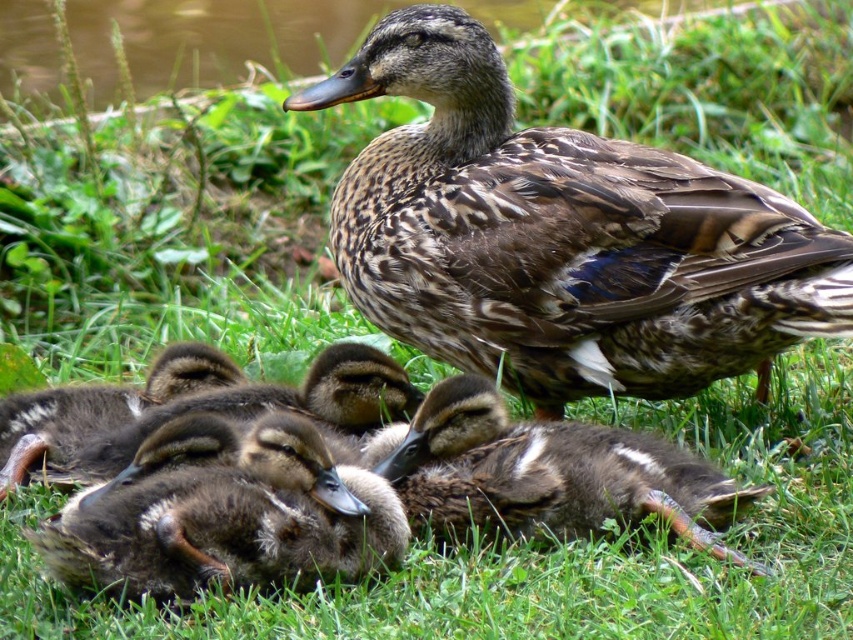
You are a photographer trying to capture a closeup of the brown fluffy duckling at lower center without disturbing the mother duck. Since the mother duck has brown speckled feathers at center, which is above the duckling, where should you position your camera relative to the duckling to avoid the mother blocking the shot?

To avoid the mother duck blocking the shot, position your camera below the brown fluffy duckling at lower center since the brown speckled feathers at center is above it.

You are a wildlife photographer trying to capture a closeup shot of the ducklings. You have a camera lens that can focus on objects up to 15 cm wide. The brown fluffy duckling at lower center and the brown downy duckling at center are both in your frame. Which duckling is more likely to fit within your camera lens focus range?

The brown fluffy duckling at lower center has a lesser width compared to the brown downy duckling at center. Since the camera lens can focus on objects up to 15 cm wide, the brown fluffy duckling at lower center is more likely to fit within the focus range as it is narrower than the other duckling.

You are a photographer trying to capture the mother duck and her ducklings. You notice the brown speckled feathers at center and the brown downy duckling at center. Which one is closer to the camera?

The brown downy duckling at center is behind the brown speckled feathers at center, so the brown speckled feathers at center is closer to the camera.